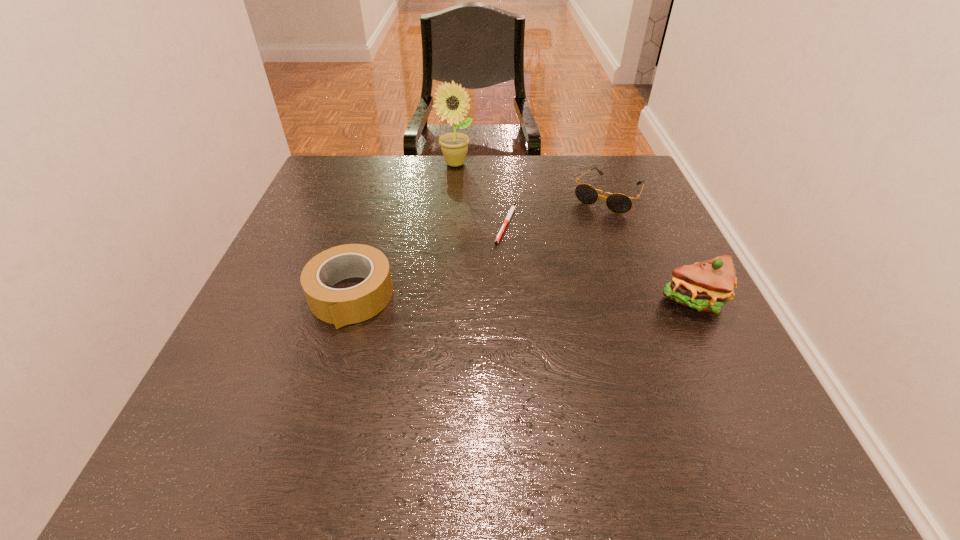
Where is `vacant space located on the front-facing side of the sunglasses`? The width and height of the screenshot is (960, 540). vacant space located on the front-facing side of the sunglasses is located at coordinates (527, 316).

I want to click on vacant region located 0.220m on the front-facing side of the sunglasses, so click(563, 263).

Identify the location of free space located 0.160m on the face of the sunflower. (477, 200).

Locate an element on the screen. The image size is (960, 540). free spot located 0.070m on the face of the sunflower is located at coordinates (468, 183).

Locate an element on the screen. The width and height of the screenshot is (960, 540). vacant space situated 0.070m on the face of the sunflower is located at coordinates (468, 183).

The height and width of the screenshot is (540, 960). I want to click on vacant region located on the clicker of the third object from left to right, so click(x=564, y=368).

Locate an element on the screen. This screenshot has width=960, height=540. blank area located on the clicker of the third object from left to right is located at coordinates (535, 300).

This screenshot has height=540, width=960. In order to click on free spot located on the clicker of the third object from left to right in this screenshot , I will do `click(559, 354)`.

What are the coordinates of `sunglasses present at the far edge` in the screenshot? It's located at (618, 203).

At what (x,y) coordinates should I click in order to perform the action: click on sunflower that is positioned at the far edge. Please return your answer as a coordinate pair (x, y). This screenshot has height=540, width=960. Looking at the image, I should click on (454, 146).